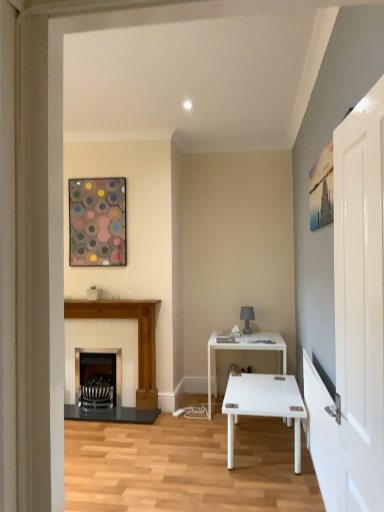
Question: Visually, is wooden fireplace at left, placed as the second fireplace when sorted from left to right, positioned to the left or to the right of matte gray lamp at center?

Choices:
 (A) right
 (B) left

Answer: (B)

Question: Looking at their shapes, would you say wooden fireplace at left, placed as the second fireplace when sorted from left to right, is wider or thinner than matte gray lamp at center?

Choices:
 (A) wide
 (B) thin

Answer: (A)

Question: Estimate the real-world distances between objects in this image. Which object is farther from the black metal fireplace at center, acting as the 1th fireplace starting from the left?

Choices:
 (A) matte gray lamp at center
 (B) white glossy door at right
 (C) wooden fireplace at left, the first fireplace when ordered from right to left
 (D) white glossy table at center
 (E) metallic hexagonal artwork at upper left

Answer: (B)

Question: Which is farther from the white glossy door at right?

Choices:
 (A) metallic hexagonal artwork at upper left
 (B) black metal fireplace at center, acting as the 1th fireplace starting from the left
 (C) white glossy table at center
 (D) wooden fireplace at left, placed as the second fireplace when sorted from left to right
 (E) matte gray lamp at center

Answer: (B)